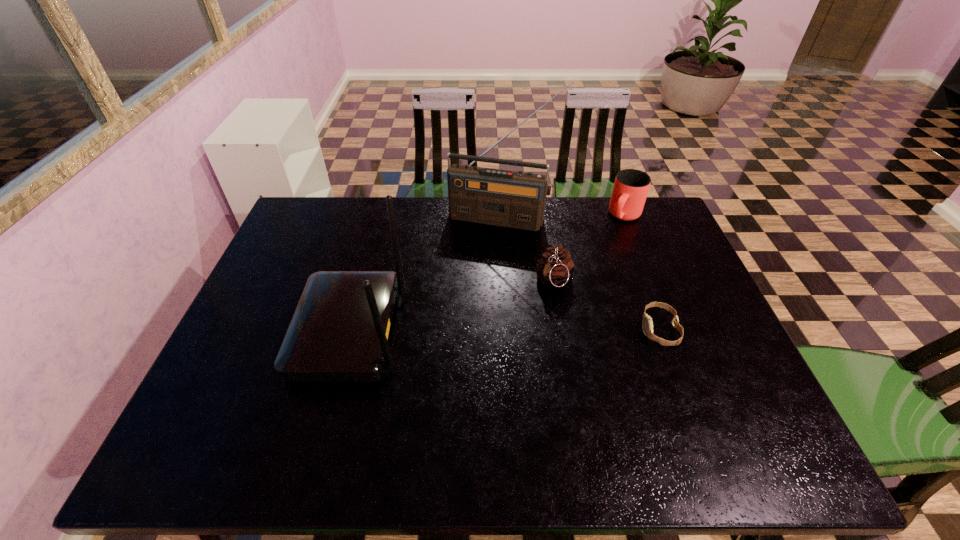
You are a GUI agent. You are given a task and a screenshot of the screen. Output one action in this format:
    pyautogui.click(x=<x>, y=<y>)
    Task: Click on the free area in between the leftmost object and the second shortest object
    The width and height of the screenshot is (960, 540).
    Given the screenshot: What is the action you would take?
    pyautogui.click(x=452, y=306)

This screenshot has width=960, height=540. Identify the location of vacant space in between the pinecone and the radio receiver. 528,249.

The image size is (960, 540). Find the location of `free space between the cup and the tallest object`. free space between the cup and the tallest object is located at coordinates [564, 217].

Locate an element on the screen. This screenshot has height=540, width=960. vacant area that lies between the watch and the fourth tallest object is located at coordinates (607, 305).

The height and width of the screenshot is (540, 960). I want to click on object that can be found as the second closest to the pinecone, so click(x=505, y=198).

I want to click on the closest object to the leftmost object, so click(x=505, y=198).

Where is `free region that satisfies the following two spatial constraints: 1. on the front side of the radio receiver; 2. on the right side of the pinecone`? Image resolution: width=960 pixels, height=540 pixels. free region that satisfies the following two spatial constraints: 1. on the front side of the radio receiver; 2. on the right side of the pinecone is located at coordinates (505, 280).